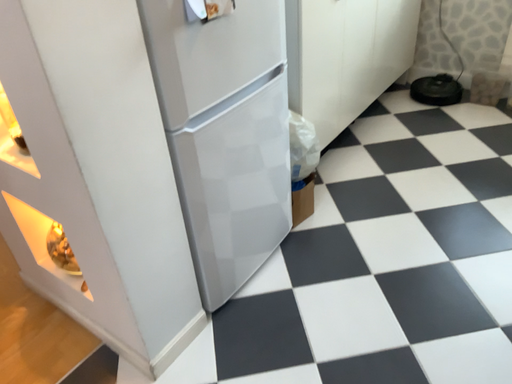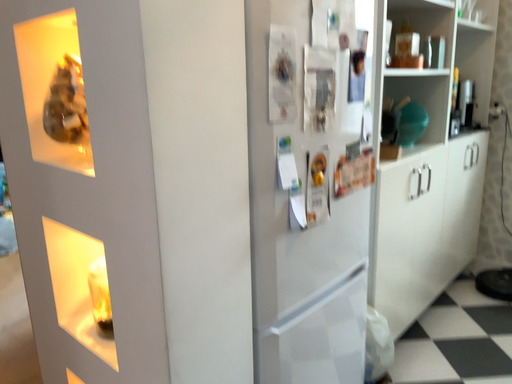
Question: How did the camera likely rotate when shooting the video?

Choices:
 (A) rotated downward
 (B) rotated upward

Answer: (B)